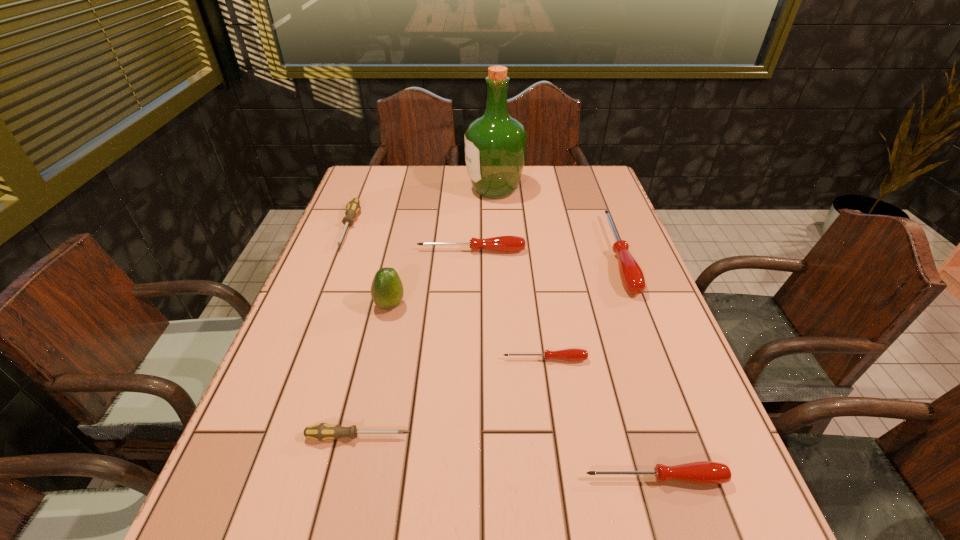
Where is `vacant area between the tallest object and the leftmost object`? vacant area between the tallest object and the leftmost object is located at coordinates (421, 208).

Find the location of a particular element. vacant area that lies between the avocado and the third smallest red screwdriver is located at coordinates (430, 278).

The width and height of the screenshot is (960, 540). I want to click on free spot between the fifth farthest screwdriver and the nearest screwdriver, so click(505, 457).

What are the coordinates of `vacant region between the green liquor and the nearest red screwdriver` in the screenshot? It's located at (575, 334).

Locate an element on the screen. The height and width of the screenshot is (540, 960). vacant point located between the second biggest red screwdriver and the nearer gray screwdriver is located at coordinates (414, 343).

Find the location of a particular element. Image resolution: width=960 pixels, height=540 pixels. vacant region between the shortest object and the nearest object is located at coordinates (600, 418).

The width and height of the screenshot is (960, 540). What are the coordinates of `vacant space that's between the sixth shortest object and the right gray screwdriver` in the screenshot? It's located at (487, 346).

Identify the location of free spot between the tallest object and the leftmost screwdriver. (421, 208).

You are a GUI agent. You are given a task and a screenshot of the screen. Output one action in this format:
    pyautogui.click(x=<x>, y=<y>)
    Task: Click on the empty space between the seventh shortest object and the farther gray screwdriver
    
    Given the screenshot: What is the action you would take?
    pyautogui.click(x=370, y=266)

In order to click on object that is the sixth closest to the tallest object in this screenshot , I will do [x=322, y=431].